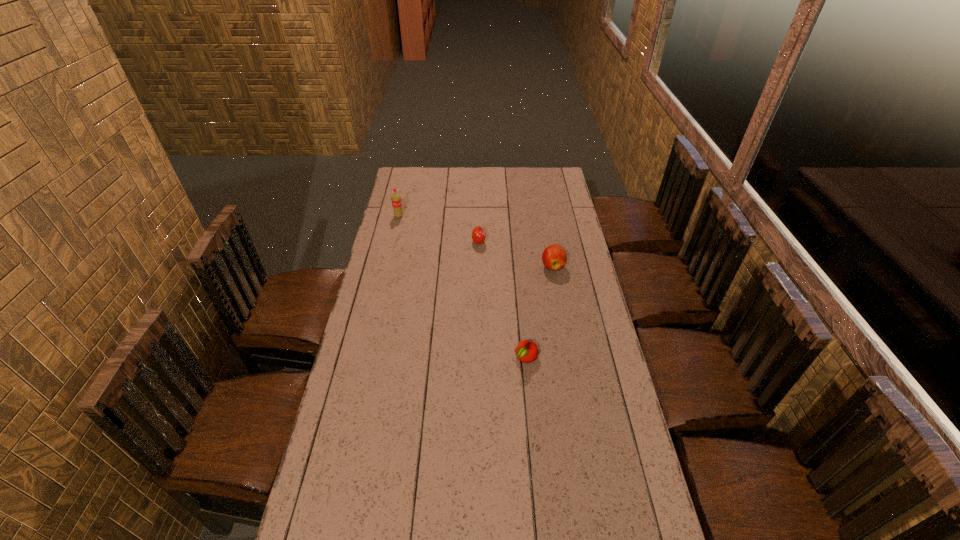
The height and width of the screenshot is (540, 960). In order to click on vacant space located on the right of the leftmost apple in this screenshot , I will do `click(559, 242)`.

In order to click on vacant space located on the front of the nearest apple in this screenshot , I will do `click(539, 488)`.

I want to click on object that is at the left edge, so click(x=396, y=199).

I want to click on object located at the right edge, so click(554, 257).

Find the location of a particular element. vacant space at the left edge is located at coordinates (360, 340).

Identify the location of free space at the right edge of the desktop. (625, 530).

Locate an element on the screen. The image size is (960, 540). vacant position at the far right corner of the desktop is located at coordinates (547, 179).

At what (x,y) coordinates should I click in order to perform the action: click on empty space that is in between the leftmost apple and the tallest apple. Please return your answer as a coordinate pair (x, y). Image resolution: width=960 pixels, height=540 pixels. Looking at the image, I should click on (516, 254).

Image resolution: width=960 pixels, height=540 pixels. In order to click on vacant area that lies between the second shortest apple and the leftmost object in this screenshot , I will do `click(439, 230)`.

Identify the location of free space between the second apple from right to left and the leftmost apple. (503, 300).